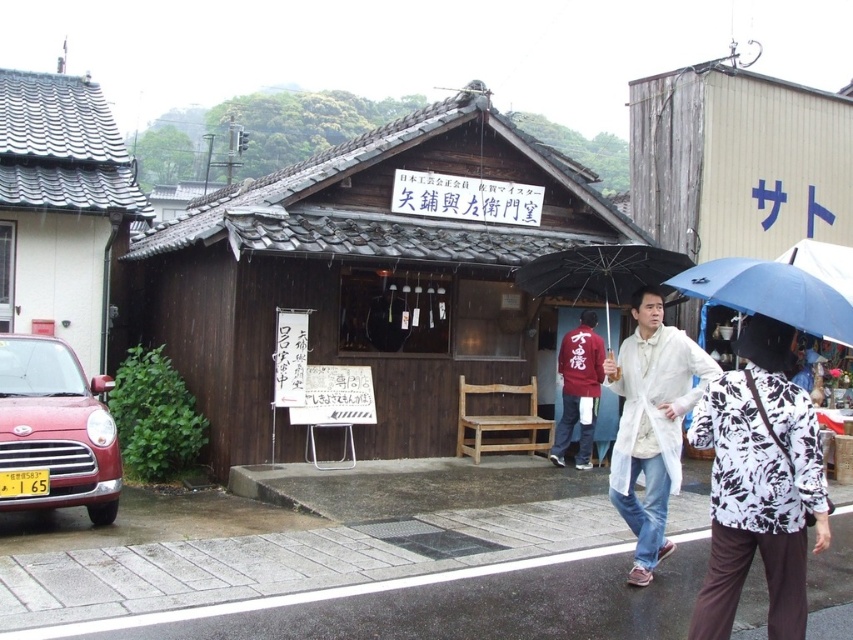
Is shiny red car at lower left in front of blue matte umbrella at center?

No, shiny red car at lower left is behind blue matte umbrella at center.

You are a GUI agent. You are given a task and a screenshot of the screen. Output one action in this format:
    pyautogui.click(x=<x>, y=<y>)
    Task: Click on the shiny red car at lower left
    This screenshot has width=853, height=640.
    Given the screenshot: What is the action you would take?
    pyautogui.click(x=54, y=432)

In order to click on shiny red car at lower left in this screenshot , I will do `click(54, 432)`.

This screenshot has width=853, height=640. Find the location of `shiny red car at lower left`. shiny red car at lower left is located at coordinates (54, 432).

The width and height of the screenshot is (853, 640). Describe the element at coordinates (651, 422) in the screenshot. I see `white matte coat at center` at that location.

Who is positioned more to the right, white matte coat at center or blue matte umbrella at center?

Positioned to the right is white matte coat at center.

Between point (627, 392) and point (773, 276), which one is positioned behind?

The point (627, 392) is behind.

I want to click on white matte coat at center, so click(651, 422).

Between point (15, 356) and point (701, 392), which one is positioned behind?

Point (15, 356)

Is shiny red car at lower left smaller than white matte coat at center?

No, shiny red car at lower left is not smaller than white matte coat at center.

Which is behind, point (73, 477) or point (657, 550)?

Positioned behind is point (73, 477).

At what (x,y) coordinates should I click in order to perform the action: click on shiny red car at lower left. Please return your answer as a coordinate pair (x, y). This screenshot has height=640, width=853. Looking at the image, I should click on coord(54,432).